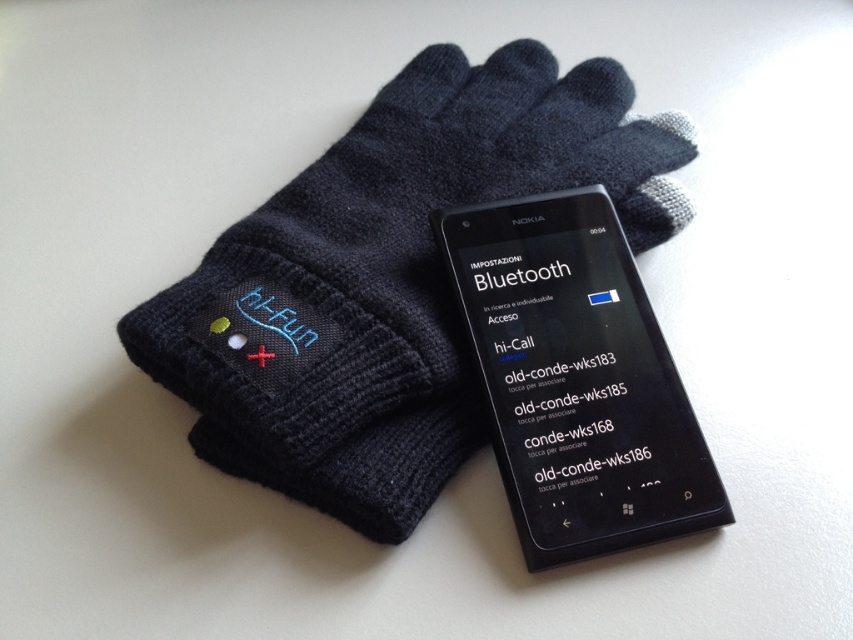
Is point (445, 378) closer to viewer compared to point (602, 388)?

Yes, point (445, 378) is closer to viewer.

Who is more distant from viewer, (434, 161) or (520, 449)?

Positioned behind is point (434, 161).

This screenshot has height=640, width=853. Identify the location of black knitted glove at upper center. (387, 280).